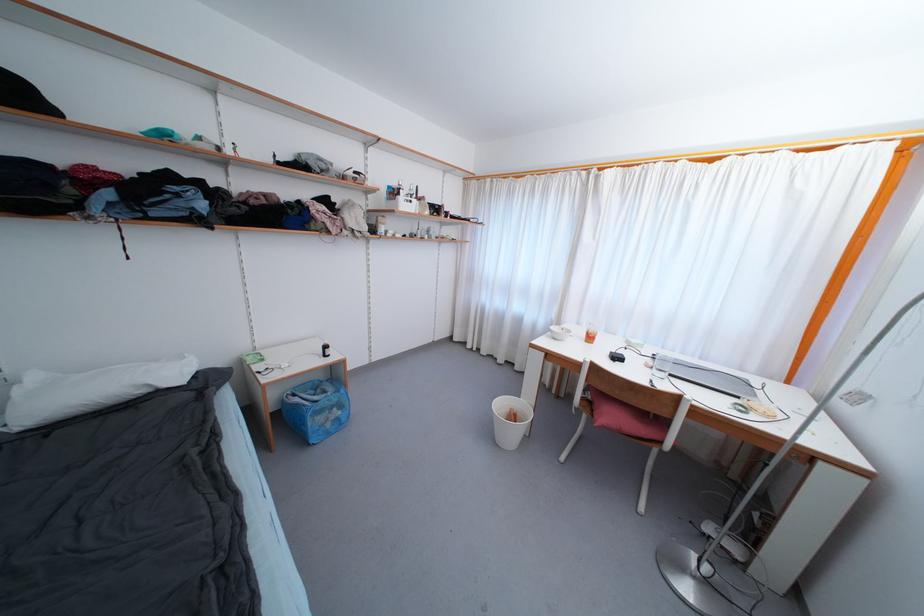
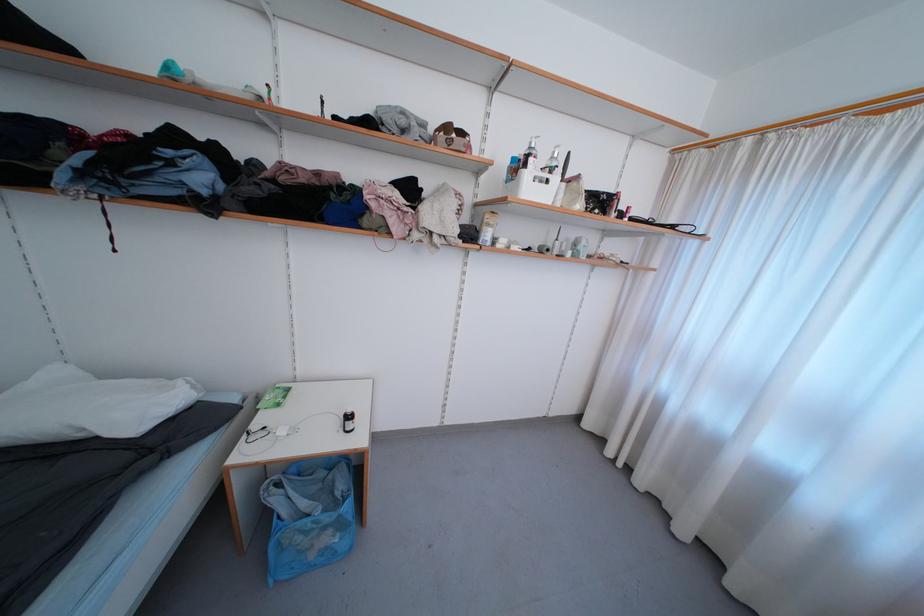
Find the pixel in the second image that matches point 405,201 in the first image.

(531, 177)